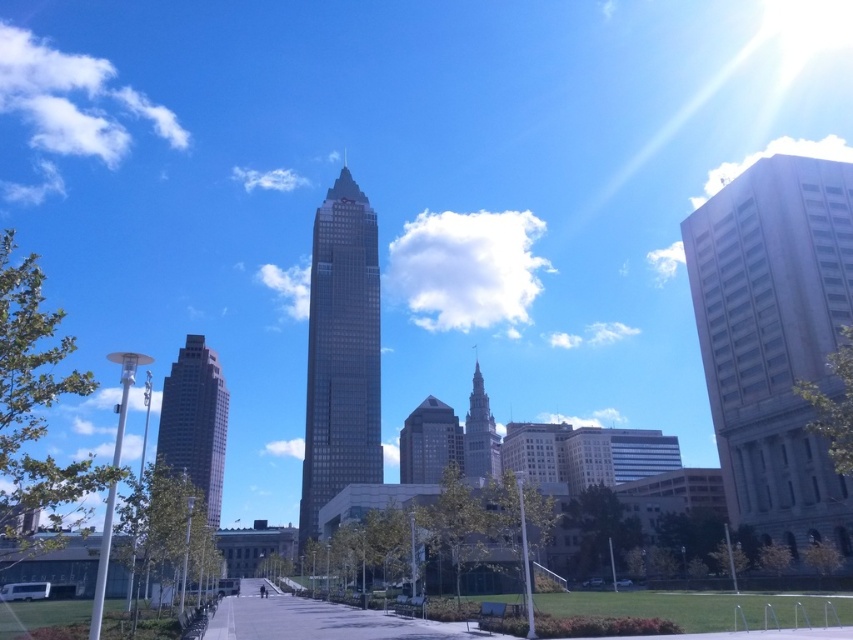
You are a city planner reviewing the layout of the city. You need to determine if the dark brown glass skyscraper at center is positioned over the gray concrete pavement at center. Based on the scene, can you confirm this?

The dark brown glass skyscraper at center is located above gray concrete pavement at center, so yes, it is positioned over the gray concrete pavement at center.

You are standing on the gray concrete pavement at center and want to take a photo of the dark brown glass skyscraper at center. Which direction should you face to capture the skyscraper in your view?

You should face to the left because the dark brown glass skyscraper at center is located to the left of the gray concrete pavement at center where you are standing.

You are standing on the paved walkway in the foreground and looking towards the dark brown glass skyscraper at center and the matte glass skyscraper at center. Which one appears higher in the image?

The dark brown glass skyscraper at center appears higher because it is located above the matte glass skyscraper at center in the image.